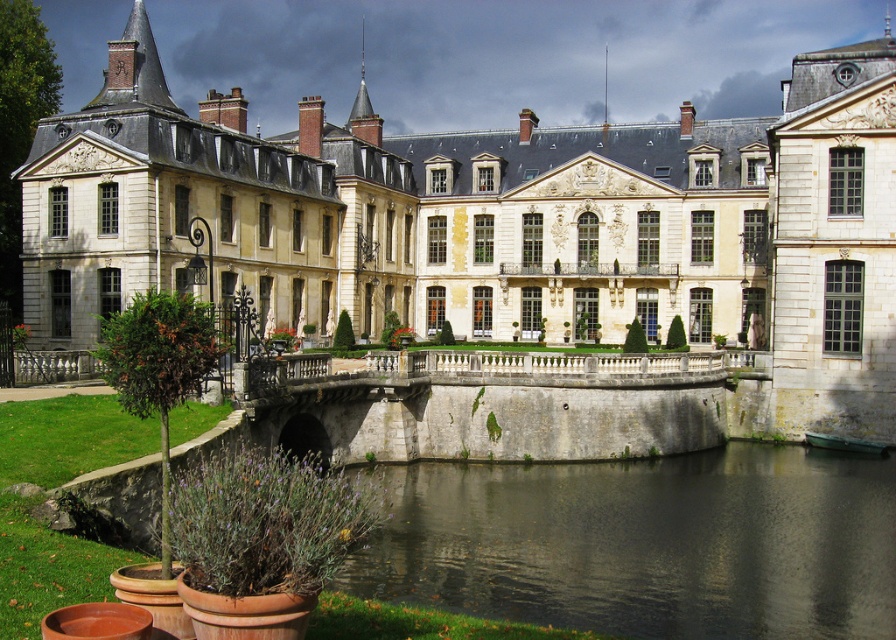
You are a visitor standing in front of the white stone palace at center. You want to cross to the other side of the dark gray stone river at center. Is there a bridge available for you to use?

The dark gray stone river at center is behind the white stone palace at center, so there is no bridge visible in the scene to cross the river.

You are standing in front of the historic chateau and want to take a photo. You notice two points marked as point (162, 252) and point (743, 474). Which point is closer to your camera position?

Point (162, 252) is further to the camera than point (743, 474), so the point closer to the camera is point (743, 474).

You are a tour guide explaining the architectural features of the scene. Which of the two objects, the white stone palace at center or the gray stone bridge at center, would you highlight as the larger structure?

The white stone palace at center is bigger than the gray stone bridge at center, so it is the larger structure and should be highlighted.